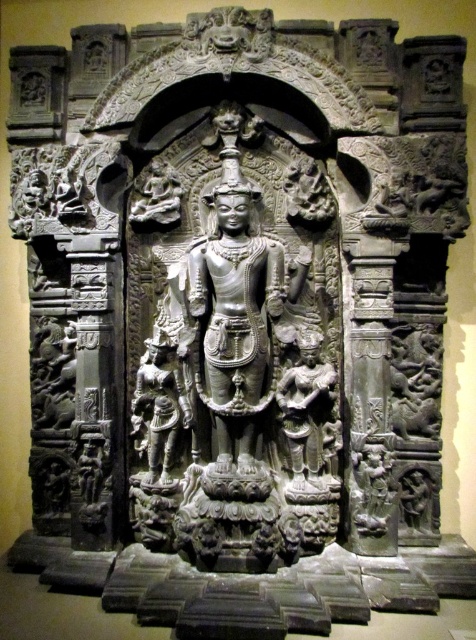
Between dark gray stone statue at center and gray stone figure at lower left, which one appears on the right side from the viewer's perspective?

Positioned to the right is dark gray stone statue at center.

Between point (283, 339) and point (138, 433), which one is positioned behind?

The point (138, 433) is behind.

Does point (296, 481) lie behind point (152, 410)?

That is False.

Where is `dark gray stone statue at center`? The image size is (476, 640). dark gray stone statue at center is located at coordinates (307, 410).